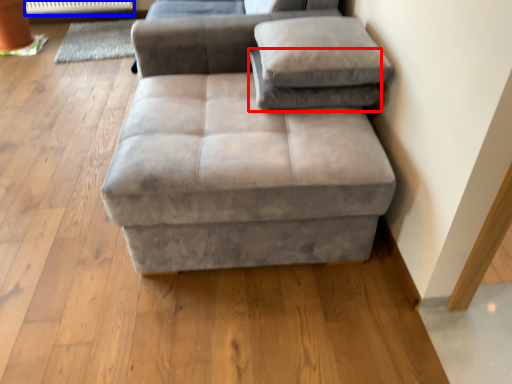
Question: Among these objects, which one is farthest to the camera, pillow (highlighted by a red box) or radiator (highlighted by a blue box)?

Choices:
 (A) pillow
 (B) radiator

Answer: (B)